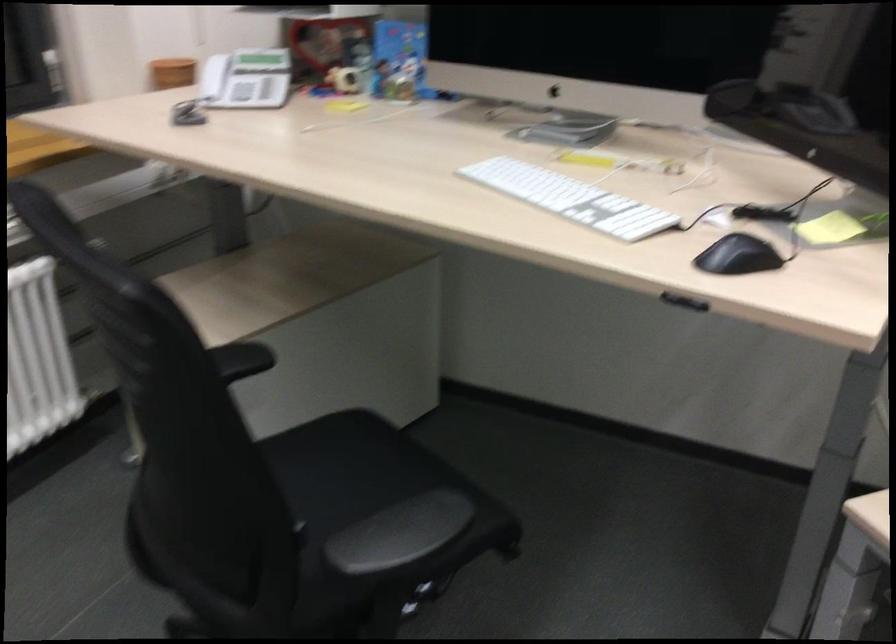
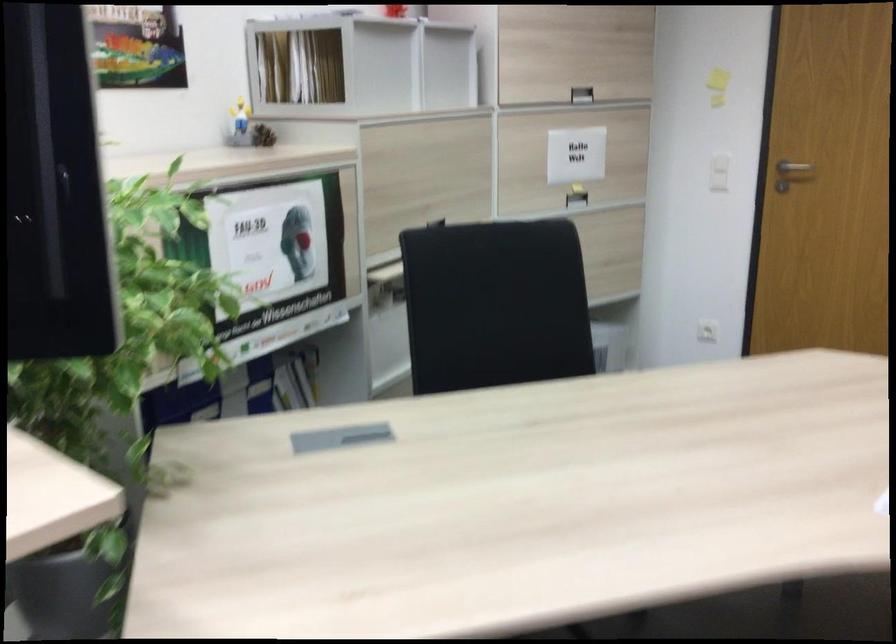
Question: The images are taken continuously from a first-person perspective. In which direction is your viewpoint rotating?

Choices:
 (A) Left
 (B) Right
 (C) Up
 (D) Down

Answer: (B)